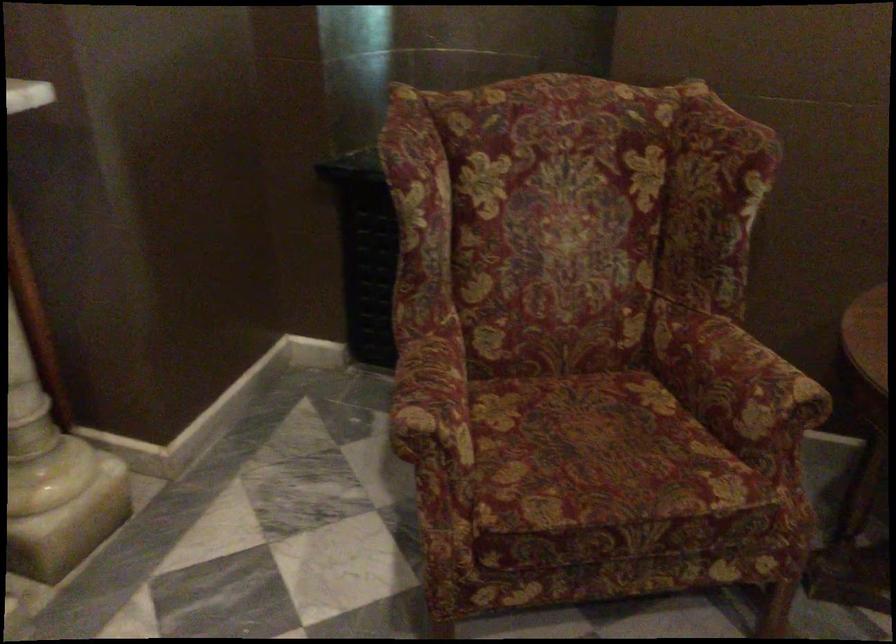
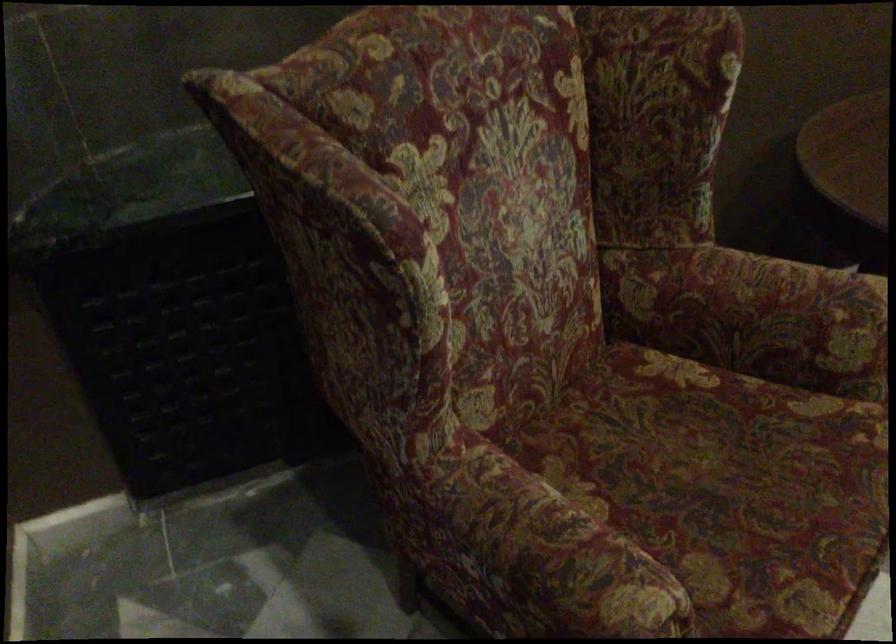
The point at (406, 386) is marked in the first image. Where is the corresponding point in the second image?

(543, 559)